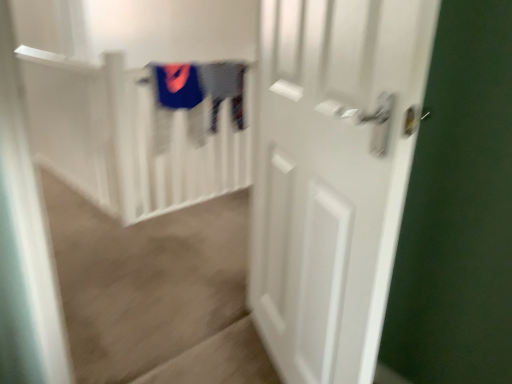
Question: From the image's perspective, is gray cotton sweater at upper center, which is the first clothing from right to left, on white matte door at right?

Choices:
 (A) yes
 (B) no

Answer: (A)

Question: From a real-world perspective, is gray cotton sweater at upper center, which is the first clothing from right to left, physically below white matte door at right?

Choices:
 (A) yes
 (B) no

Answer: (B)

Question: From a real-world perspective, is gray cotton sweater at upper center, the second clothing from the left, over white matte door at right?

Choices:
 (A) no
 (B) yes

Answer: (B)

Question: Does gray cotton sweater at upper center, the second clothing from the left, have a lesser height compared to white matte door at right?

Choices:
 (A) yes
 (B) no

Answer: (A)

Question: Is gray cotton sweater at upper center, the second clothing from the left, facing away from white matte door at right?

Choices:
 (A) yes
 (B) no

Answer: (B)

Question: Visually, is white matte door at right positioned to the left or to the right of velvet blue sweater at upper center, which is counted as the first clothing, starting from the left?

Choices:
 (A) left
 (B) right

Answer: (B)

Question: In terms of size, does white matte door at right appear bigger or smaller than velvet blue sweater at upper center, which is counted as the first clothing, starting from the left?

Choices:
 (A) small
 (B) big

Answer: (B)

Question: From a real-world perspective, is white matte door at right positioned above or below velvet blue sweater at upper center, positioned as the 2th clothing in right-to-left order?

Choices:
 (A) below
 (B) above

Answer: (A)

Question: Is white matte door at right spatially inside velvet blue sweater at upper center, positioned as the 2th clothing in right-to-left order, or outside of it?

Choices:
 (A) inside
 (B) outside

Answer: (B)

Question: Considering the positions of velvet blue sweater at upper center, which is counted as the first clothing, starting from the left, and white matte stair railing at upper center in the image, is velvet blue sweater at upper center, which is counted as the first clothing, starting from the left, bigger or smaller than white matte stair railing at upper center?

Choices:
 (A) big
 (B) small

Answer: (B)

Question: Considering their positions, is velvet blue sweater at upper center, positioned as the 2th clothing in right-to-left order, located in front of or behind white matte stair railing at upper center?

Choices:
 (A) front
 (B) behind

Answer: (B)

Question: In terms of height, does velvet blue sweater at upper center, positioned as the 2th clothing in right-to-left order, look taller or shorter compared to white matte stair railing at upper center?

Choices:
 (A) tall
 (B) short

Answer: (A)

Question: Visually, is velvet blue sweater at upper center, positioned as the 2th clothing in right-to-left order, positioned to the left or to the right of white matte stair railing at upper center?

Choices:
 (A) right
 (B) left

Answer: (A)

Question: Looking at their shapes, would you say white matte door at right is wider or thinner than white matte stair railing at upper center?

Choices:
 (A) thin
 (B) wide

Answer: (A)

Question: In terms of size, does white matte door at right appear bigger or smaller than white matte stair railing at upper center?

Choices:
 (A) big
 (B) small

Answer: (B)